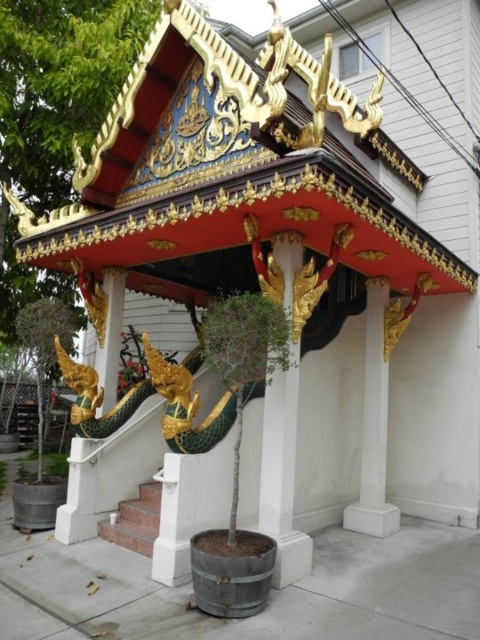
You are an architect designing a replica of this pavilion. You have two pillars to choose from, the white glossy pillar at center and the white marble pillar at center. Which pillar should you select if you want the one that is narrower?

The white glossy pillar at center has a lesser width compared to the white marble pillar at center, so you should select the white glossy pillar at center for the narrower option.